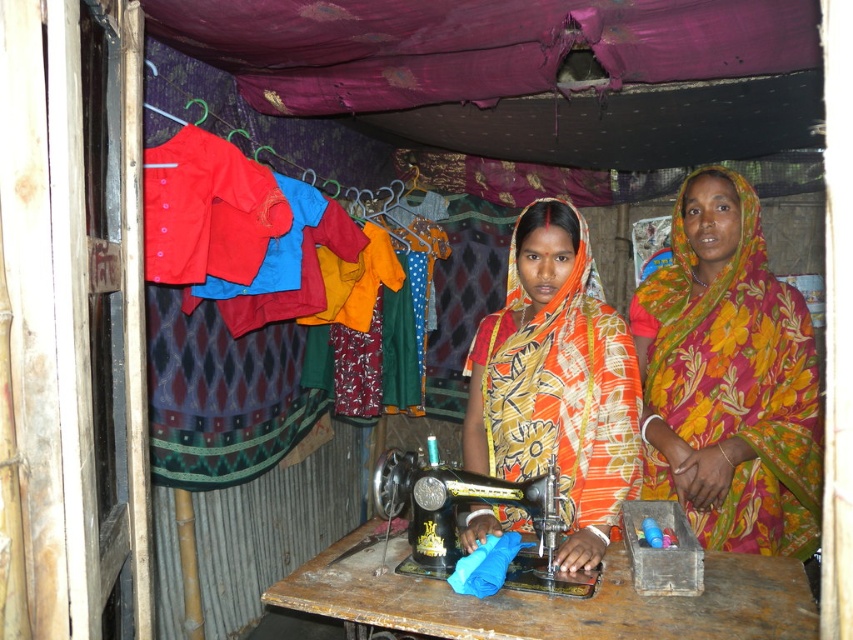
Which is more to the left, floral fabric saree at center or black metal sewing machine at center?

black metal sewing machine at center

How much distance is there between floral fabric saree at center and black metal sewing machine at center?

They are 31.33 inches apart.

I want to click on floral fabric saree at center, so click(x=729, y=380).

The image size is (853, 640). What are the coordinates of `floral fabric saree at center` in the screenshot? It's located at (729, 380).

Can you confirm if floral fabric saree at center is wider than printed cotton saree at center?

Yes, floral fabric saree at center is wider than printed cotton saree at center.

In the scene shown: Who is positioned more to the right, floral fabric saree at center or printed cotton saree at center?

floral fabric saree at center is more to the right.

Who is more forward, [735,419] or [584,308]?

Point [584,308]

At what (x,y) coordinates should I click in order to perform the action: click on floral fabric saree at center. Please return your answer as a coordinate pair (x, y). The image size is (853, 640). Looking at the image, I should click on (729, 380).

Does printed cotton saree at center appear over black metal sewing machine at center?

Yes.

Which is behind, point (633, 396) or point (527, 560)?

The point (633, 396) is behind.

This screenshot has width=853, height=640. I want to click on printed cotton saree at center, so click(x=556, y=381).